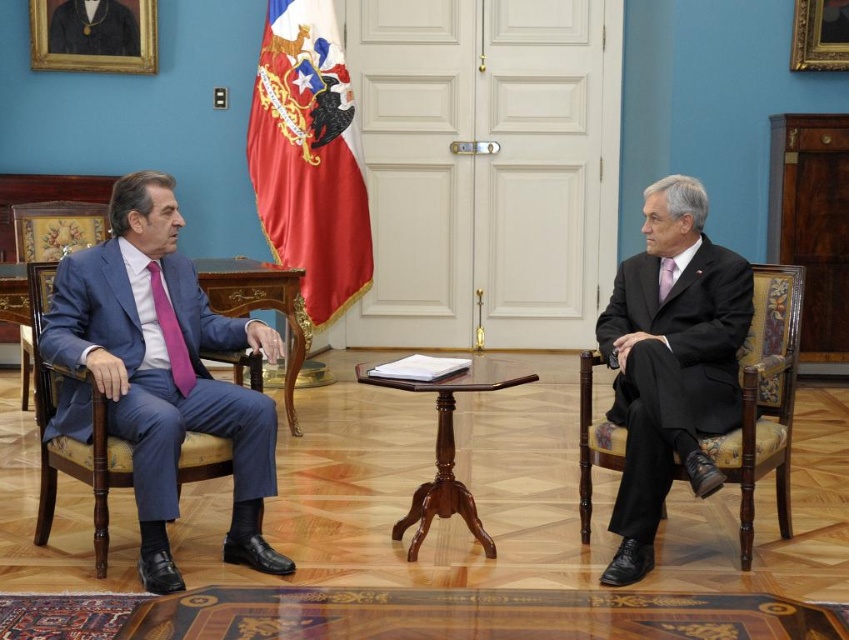
In the scene shown: You are an interior designer planning to place a new lamp on the table between the two men. The table is round and has a diameter of 1.2 meters. The blue upholstered chair at left is located at coordinates point (x=77, y=460). If the lamp must be placed exactly at the center of the table, will it interfere with the blue upholstered chair at left?

The blue upholstered chair at left is located at point (x=77, y=460). Since the lamp is placed at the center of the table, which is equidistant from all edges, it will not interfere with the blue upholstered chair at left as it is centrally positioned.